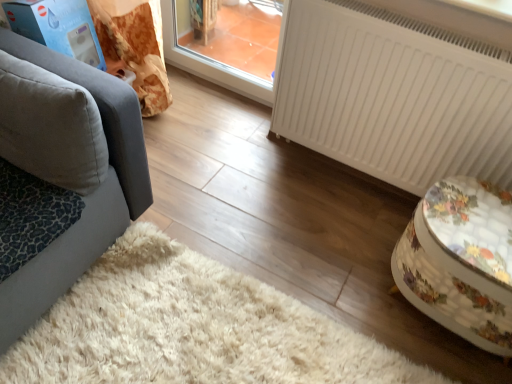
You are a GUI agent. You are given a task and a screenshot of the screen. Output one action in this format:
    pyautogui.click(x=<x>, y=<y>)
    Task: Click on the free space that is to the left of floral fabric ottoman at right
    
    Given the screenshot: What is the action you would take?
    pyautogui.click(x=343, y=283)